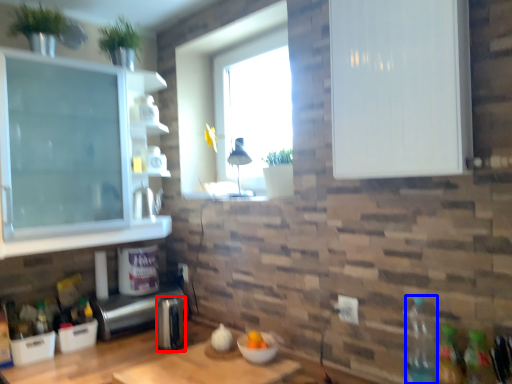
Question: Which object is further to the camera taking this photo, appliance (highlighted by a red box) or bottle (highlighted by a blue box)?

Choices:
 (A) appliance
 (B) bottle

Answer: (A)